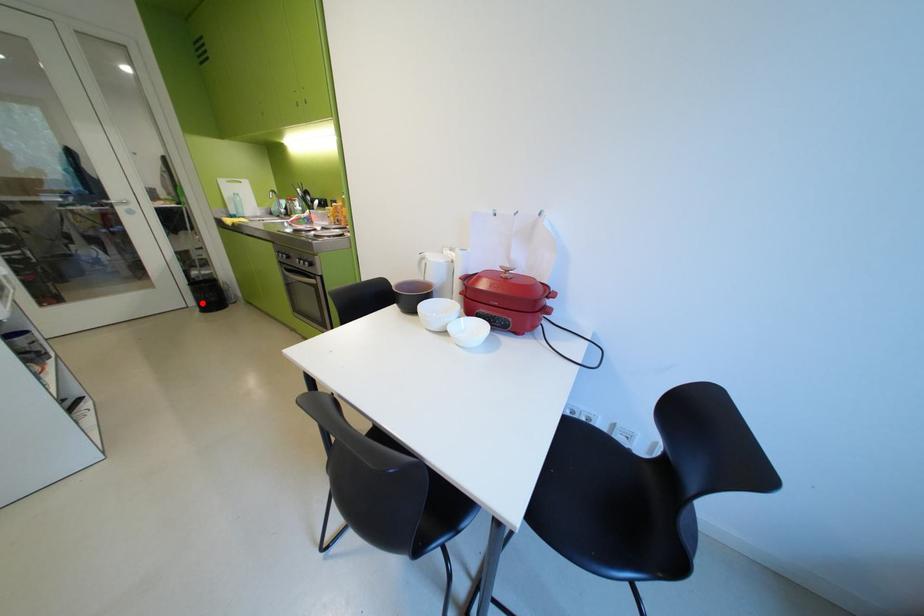
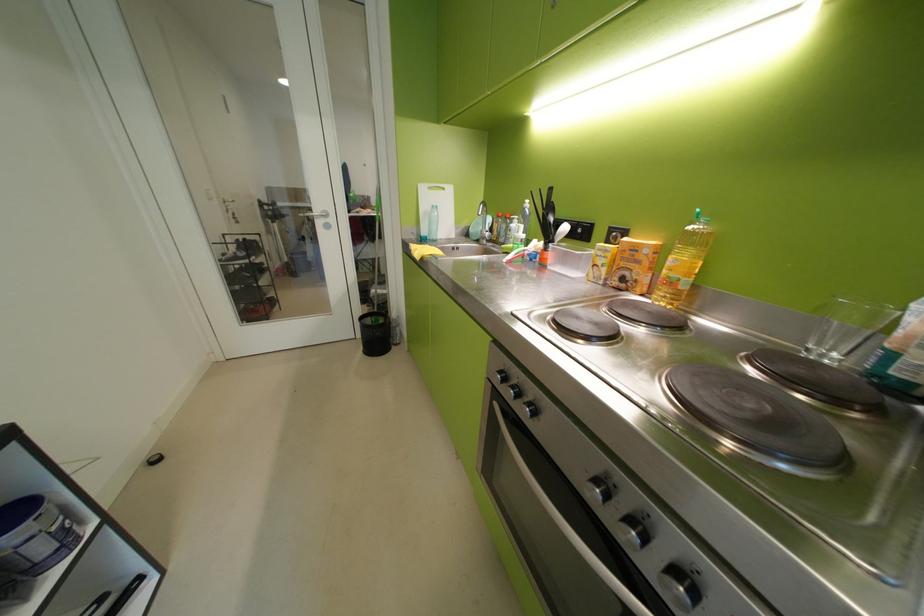
Find the pixel in the second image that matches the highlighted location in the first image.

(370, 336)